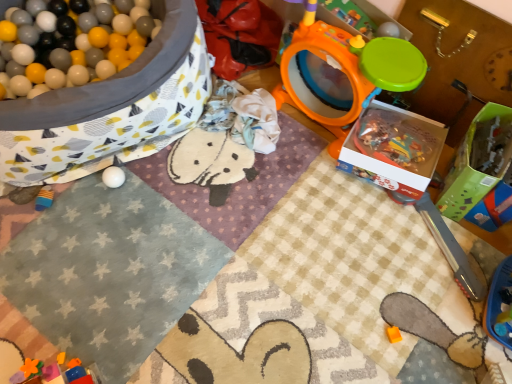
Question: Can you see orange plastic drum at upper right, the 6th toy when ordered from bottom to top, touching white textured blanket at upper left?

Choices:
 (A) no
 (B) yes

Answer: (A)

Question: Can white textured blanket at upper left be found inside orange plastic drum at upper right, arranged as the 4th toy when viewed from the left?

Choices:
 (A) yes
 (B) no

Answer: (B)

Question: Can you confirm if orange plastic drum at upper right, acting as the 1th toy starting from the top, is wider than white textured blanket at upper left?

Choices:
 (A) yes
 (B) no

Answer: (B)

Question: From the image's perspective, is orange plastic drum at upper right, arranged as the 4th toy when viewed from the left, beneath white textured blanket at upper left?

Choices:
 (A) no
 (B) yes

Answer: (A)

Question: From the image's perspective, is orange plastic drum at upper right, acting as the 1th toy starting from the top, located above white textured blanket at upper left?

Choices:
 (A) yes
 (B) no

Answer: (A)

Question: Does orange plastic drum at upper right, the 6th toy when ordered from bottom to top, appear on the right side of white textured blanket at upper left?

Choices:
 (A) no
 (B) yes

Answer: (B)

Question: From a real-world perspective, is white matte ball at lower left, which is counted as the fourth toy, starting from the right, located higher than green cardboard box at right, acting as the second box starting from the left?

Choices:
 (A) no
 (B) yes

Answer: (A)

Question: Is white matte ball at lower left, positioned as the third toy in top-to-bottom order, bigger than green cardboard box at right, which appears as the first box when viewed from the right?

Choices:
 (A) no
 (B) yes

Answer: (A)

Question: Is white matte ball at lower left, the third toy viewed from the left, not near green cardboard box at right, which appears as the first box when viewed from the right?

Choices:
 (A) no
 (B) yes

Answer: (B)

Question: Does white matte ball at lower left, positioned as the third toy in top-to-bottom order, have a greater height compared to green cardboard box at right, acting as the second box starting from the left?

Choices:
 (A) yes
 (B) no

Answer: (B)

Question: Is white matte ball at lower left, positioned as the third toy in top-to-bottom order, thinner than green cardboard box at right, which appears as the first box when viewed from the right?

Choices:
 (A) no
 (B) yes

Answer: (B)

Question: Can you confirm if white matte ball at lower left, positioned as the third toy in top-to-bottom order, is positioned to the left of green cardboard box at right, acting as the second box starting from the left?

Choices:
 (A) yes
 (B) no

Answer: (A)

Question: Is orange matte toy at lower center, acting as the 5th toy starting from the left, oriented away from rubberized plastic blocks at lower left, marked as the sixth toy in a top-to-bottom arrangement?

Choices:
 (A) yes
 (B) no

Answer: (B)